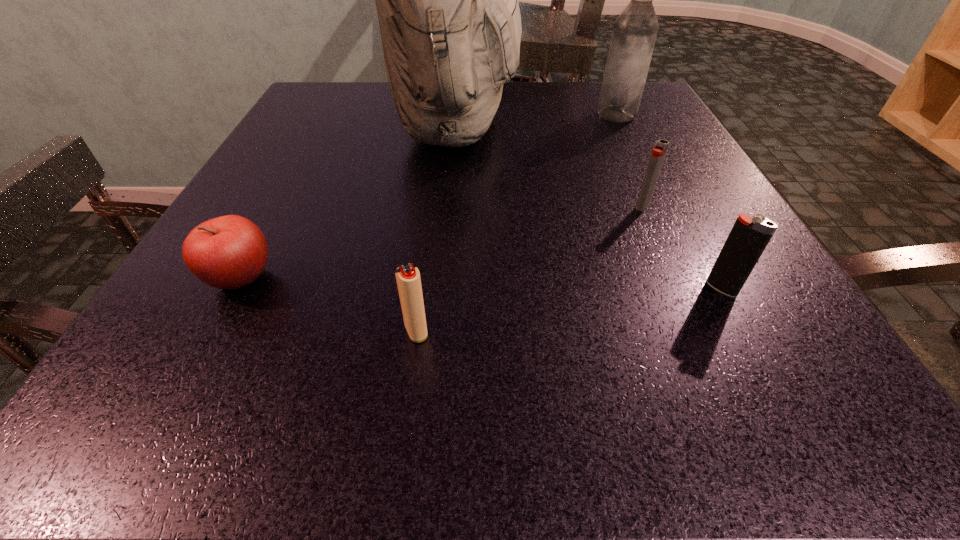
I want to click on free space that satisfies the following two spatial constraints: 1. on the front-facing side of the second nearest igniter; 2. on the right side of the tallest object, so click(x=443, y=288).

Identify the location of blank space that satisfies the following two spatial constraints: 1. on the front-facing side of the tallest object; 2. on the left side of the rightmost igniter. The image size is (960, 540). (443, 288).

The width and height of the screenshot is (960, 540). I want to click on vacant space that satisfies the following two spatial constraints: 1. on the front-facing side of the second nearest igniter; 2. on the left side of the tallest object, so click(x=443, y=288).

The height and width of the screenshot is (540, 960). I want to click on vacant space that satisfies the following two spatial constraints: 1. on the back side of the farthest igniter; 2. on the right side of the second tallest object, so point(603,114).

Find the location of a particular element. free space that satisfies the following two spatial constraints: 1. on the front-facing side of the tallest object; 2. on the left side of the second igniter from right to left is located at coordinates tap(449, 206).